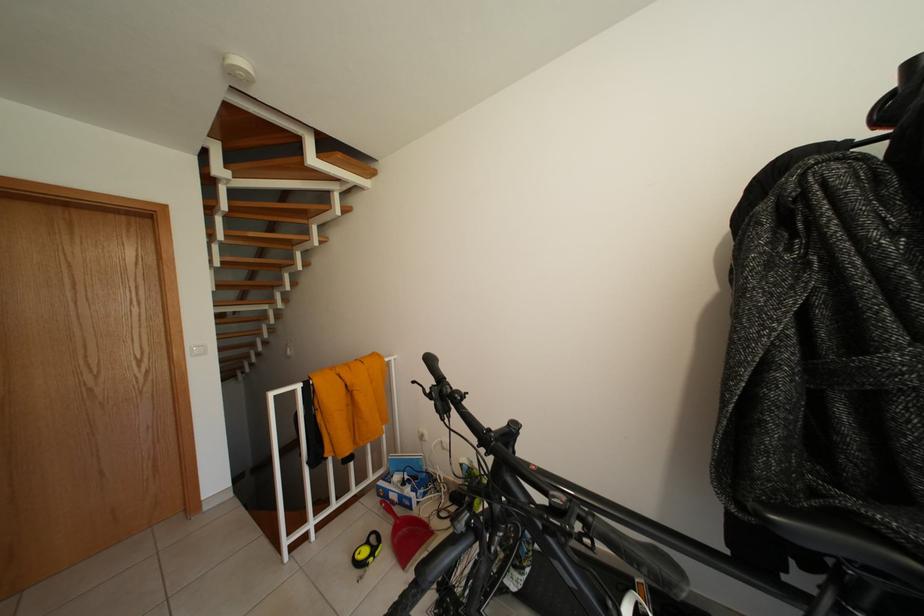
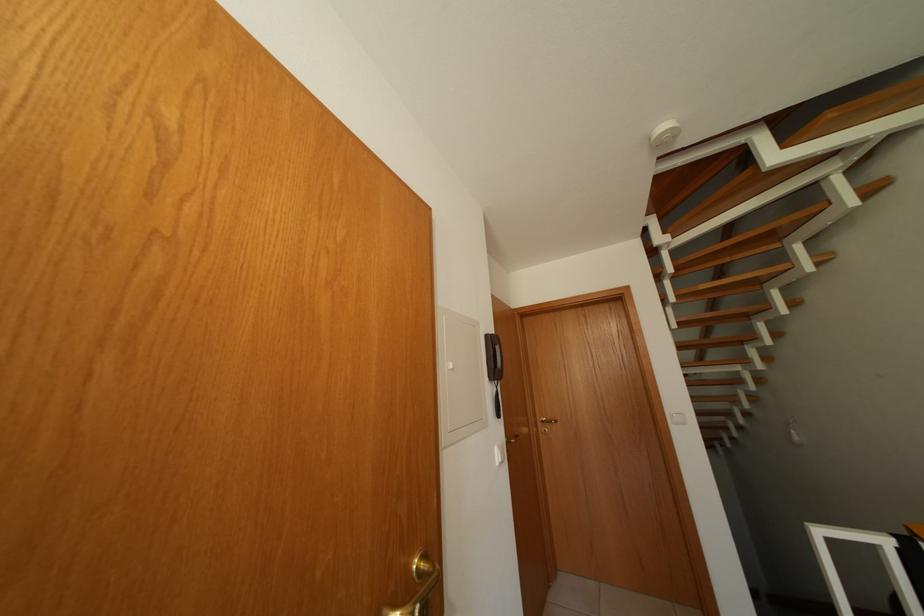
Question: Based on the continuous images, in which direction is the camera rotating? Reply with the corresponding letter.

Choices:
 (A) Left
 (B) Right
 (C) Up
 (D) Down

Answer: (A)